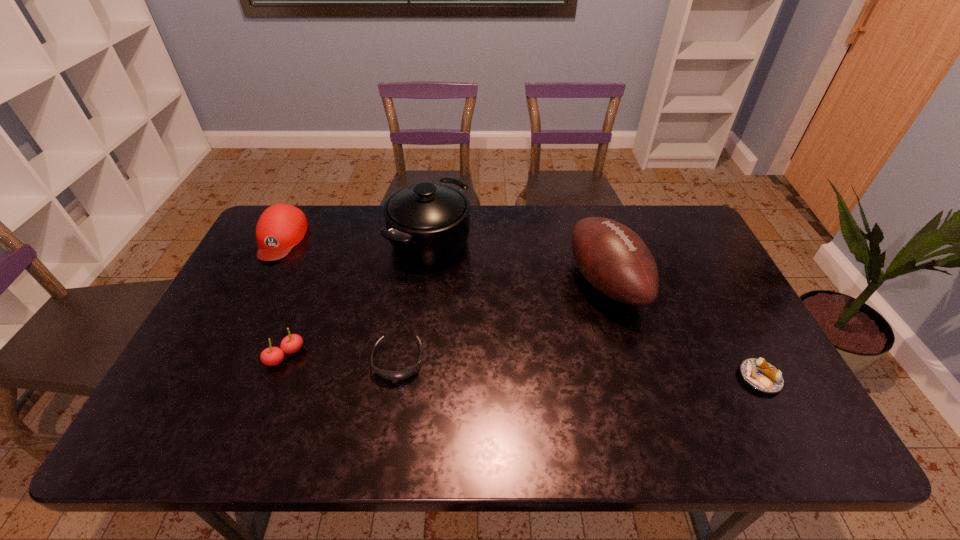
Where is `unoccupied area between the shortest object and the football (American)`? This screenshot has height=540, width=960. unoccupied area between the shortest object and the football (American) is located at coordinates (683, 330).

Image resolution: width=960 pixels, height=540 pixels. Identify the location of empty space that is in between the saucepan and the leftmost object. (355, 240).

At what (x,y) coordinates should I click in order to perform the action: click on free spot between the fourth shortest object and the rightmost object. Please return your answer as a coordinate pair (x, y). This screenshot has width=960, height=540. Looking at the image, I should click on (520, 308).

I want to click on vacant area between the rightmost object and the second object from right to left, so click(x=683, y=330).

This screenshot has height=540, width=960. In order to click on unoccupied position between the pastry and the baseball cap in this screenshot , I will do `click(520, 308)`.

The image size is (960, 540). I want to click on vacant space that is in between the football (American) and the fifth tallest object, so click(502, 321).

Locate an element on the screen. The image size is (960, 540). free point between the saucepan and the second object from right to left is located at coordinates (518, 262).

Find the location of a particular element. object that is the fourth closest to the goggles is located at coordinates (281, 227).

At what (x,y) coordinates should I click in order to perform the action: click on object that is the closest to the cherry. Please return your answer as a coordinate pair (x, y). This screenshot has height=540, width=960. Looking at the image, I should click on [x=406, y=373].

Where is `free space that satisfies the following two spatial constraints: 1. on the front-facing side of the leftmost object; 2. on the right side of the saucepan`? free space that satisfies the following two spatial constraints: 1. on the front-facing side of the leftmost object; 2. on the right side of the saucepan is located at coordinates (279, 241).